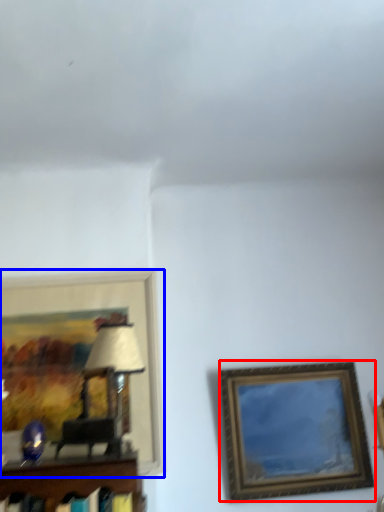
Question: Which of the following is the farthest to the observer, picture frame (highlighted by a red box) or picture frame (highlighted by a blue box)?

Choices:
 (A) picture frame
 (B) picture frame

Answer: (A)